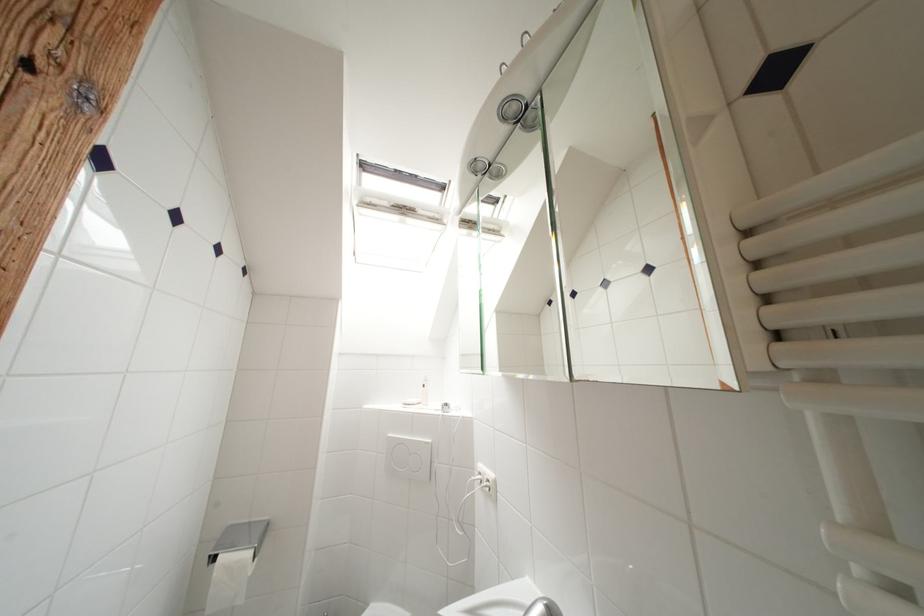
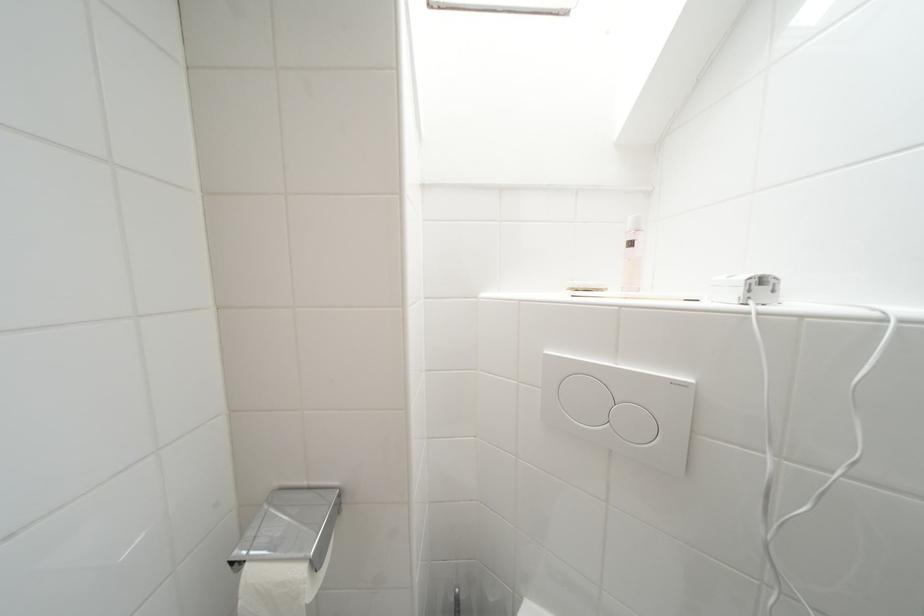
Find the pixel in the second image that matches (453,408) in the first image.

(769, 283)